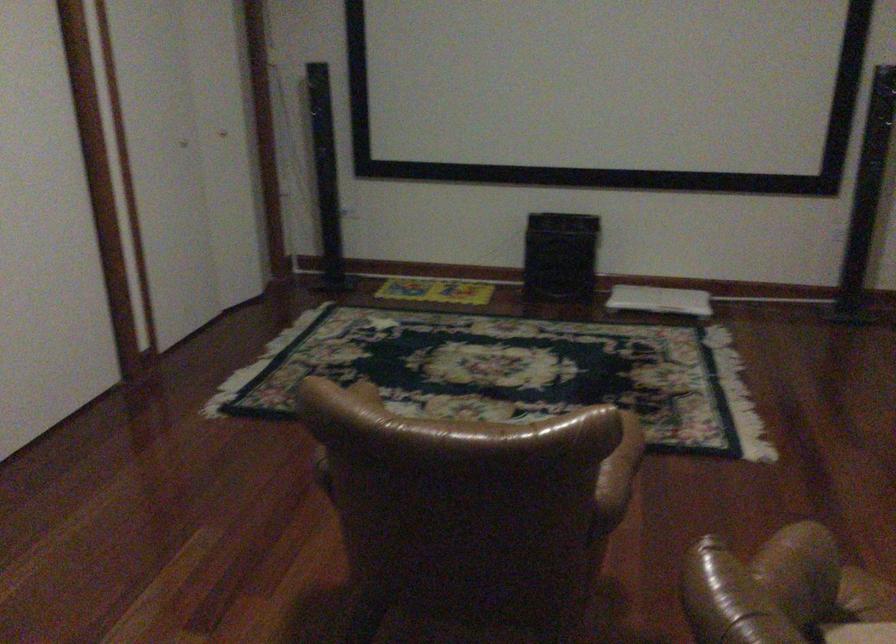
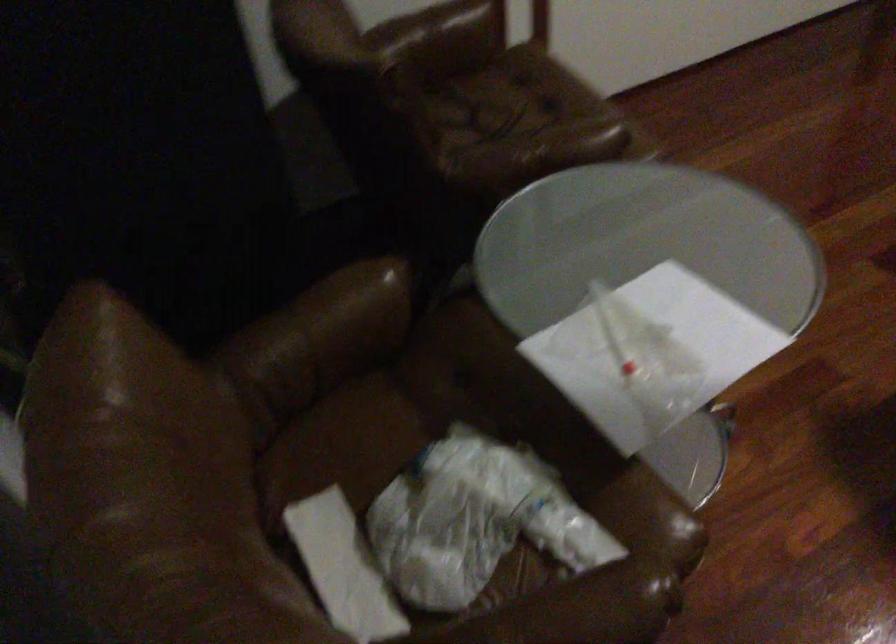
First-person continuous shooting, in which direction is the camera rotating?

The rotation direction of the camera is left-down.